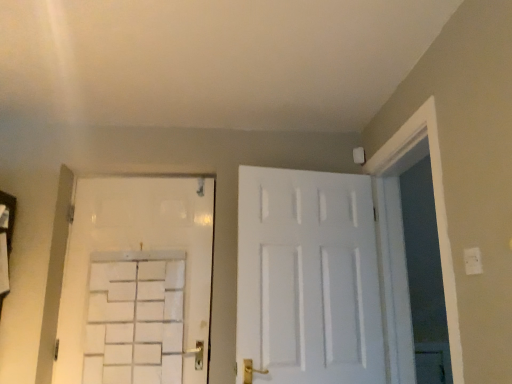
Question: Is white plastic electric outlet at upper right to the left or to the right of white matte door at upper left, positioned as the first door in left-to-right order, in the image?

Choices:
 (A) left
 (B) right

Answer: (B)

Question: Based on their sizes in the image, would you say white plastic electric outlet at upper right is bigger or smaller than white matte door at upper left, positioned as the first door in left-to-right order?

Choices:
 (A) small
 (B) big

Answer: (A)

Question: Which object is positioned closest to the white plastic electric outlet at upper right?

Choices:
 (A) white matte door at upper left, positioned as the first door in left-to-right order
 (B) white matte door at center, which is the 2th door from left to right

Answer: (B)

Question: Which of these objects is positioned closest to the white matte door at upper left, positioned as the first door in left-to-right order?

Choices:
 (A) white matte door at center, which is the 2th door from left to right
 (B) white plastic electric outlet at upper right

Answer: (A)